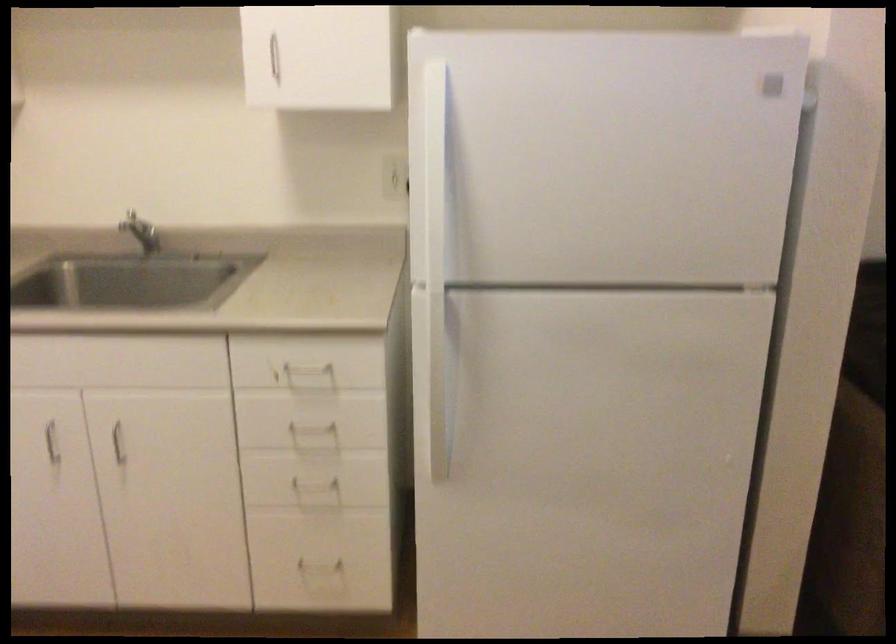
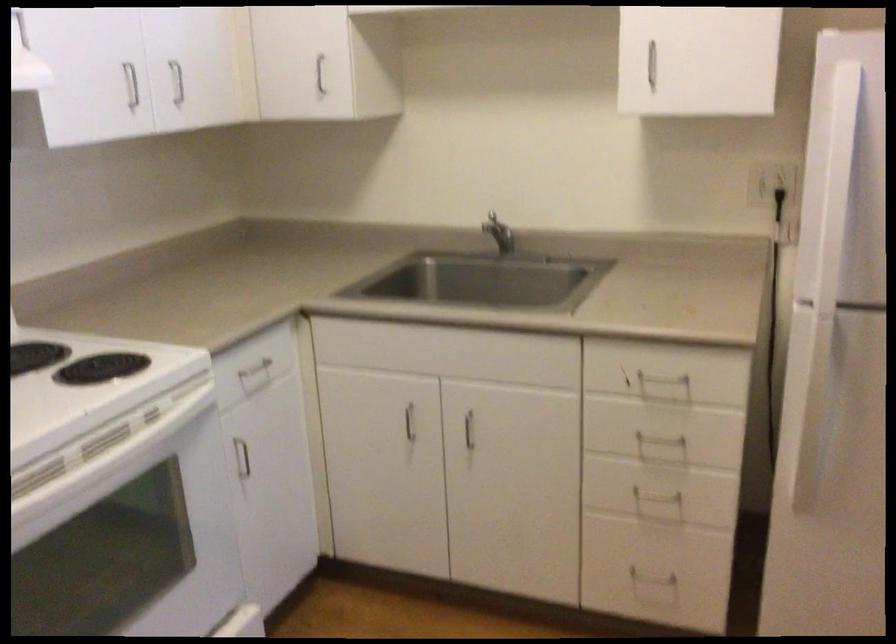
In the second image, find the point that corresponds to point 119,440 in the first image.

(469, 430)